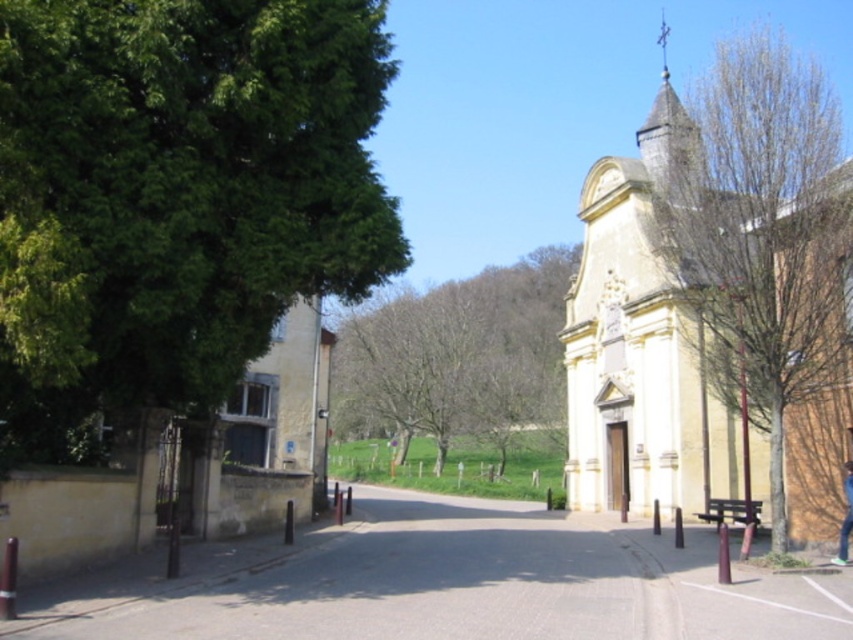
You are standing on the paved road in front of the historic building with the bell tower. You see a green leafy tree at left and blue jeans at lower right. Which object is located to the left of the other?

The green leafy tree at left is positioned on the left side of blue jeans at lower right.

You are a bird flying over the rural scene. You want to land on a tree. Which tree is taller between the green leafy tree at left and the bare wood tree at center?

The green leafy tree at left is taller than the bare wood tree at center.